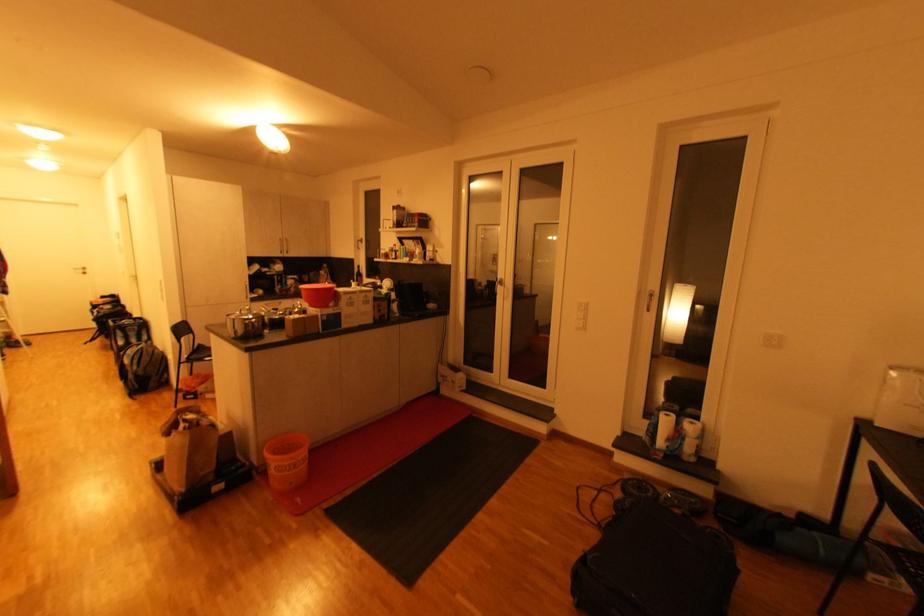
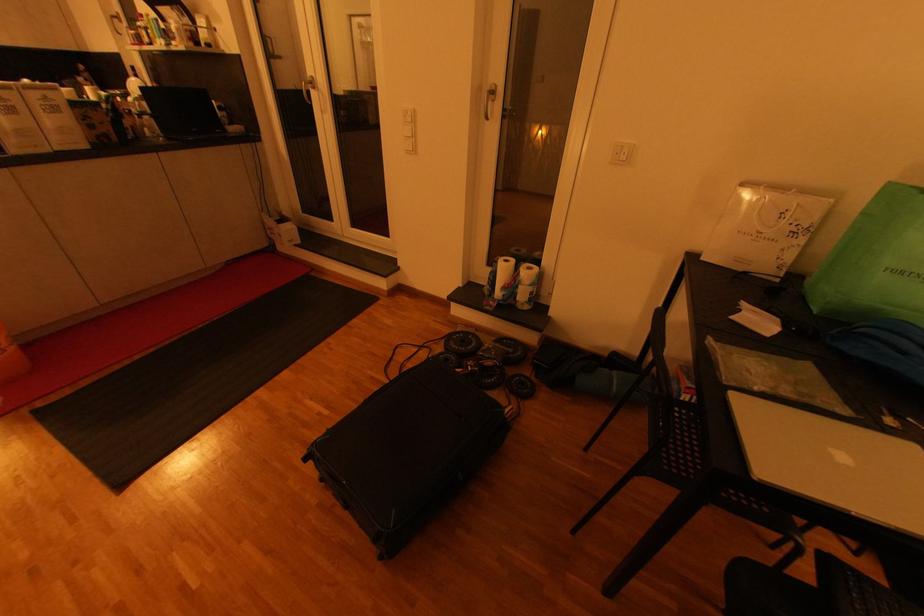
Locate, in the second image, the point that corresponds to (x=645, y=488) in the first image.

(468, 342)